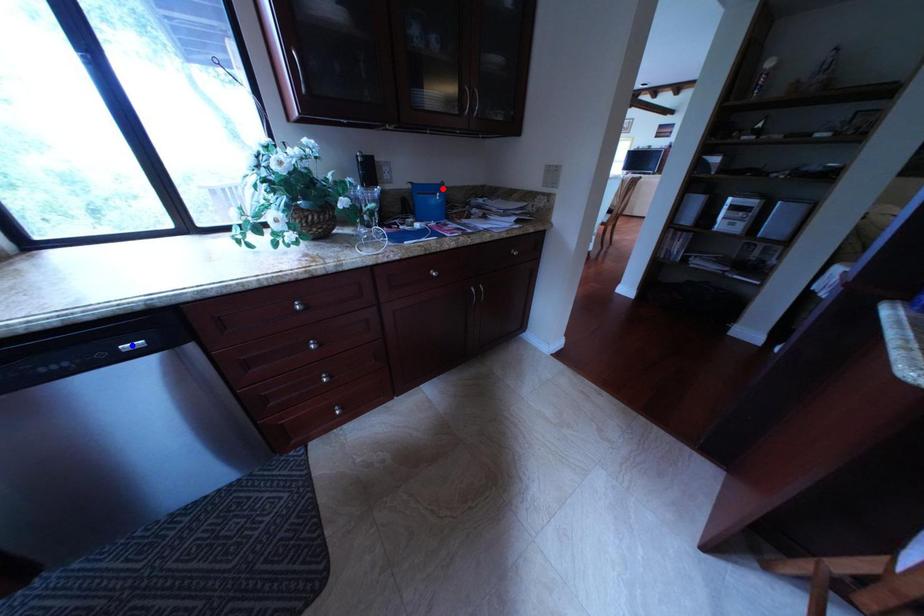
Question: Which of the two points in the image is closer to the camera?

Choices:
 (A) Blue point is closer.
 (B) Red point is closer.

Answer: (A)